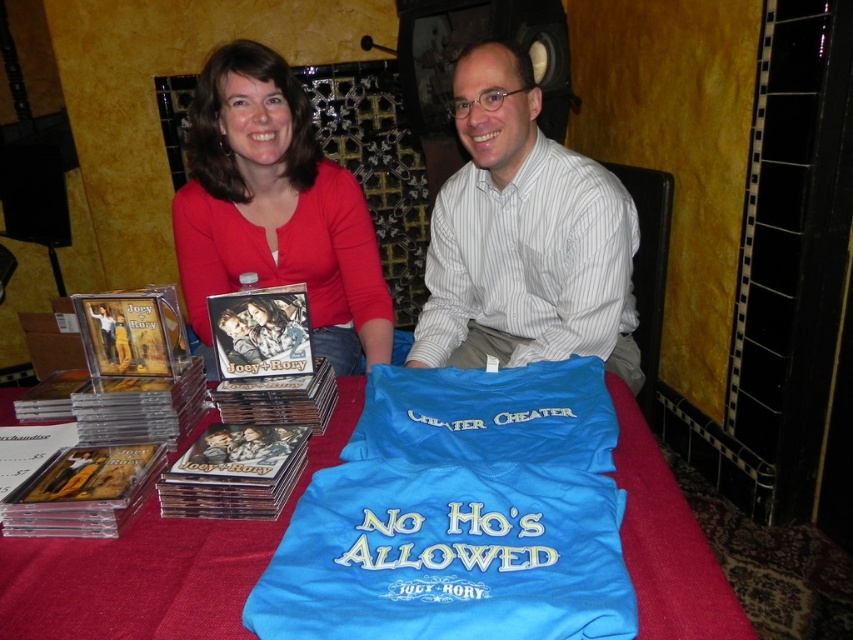
You are organizing a small event and need to place a 1.5 meter long banner between the blue fabric table at center and the matte red shirt at upper left. Given their widths, will the banner fit horizontally between them?

The blue fabric table at center is narrower than the matte red shirt at upper left. However, the banner requires 1.5 meters of space. Since the objects description only provides relative widths between the two items but does not specify their exact dimensions or the distance between them, it is impossible to determine if the banner will fit based on the given information.

You are a photographer setting up for a group photo. You want to ensure that the white striped shirt at center and the blue fabric table at center are both clearly visible in the shot. Given their height difference, which object should you focus on first to ensure proper framing?

The white striped shirt at center is much taller than the blue fabric table at center, so you should focus on the white striped shirt at center first to ensure proper framing.